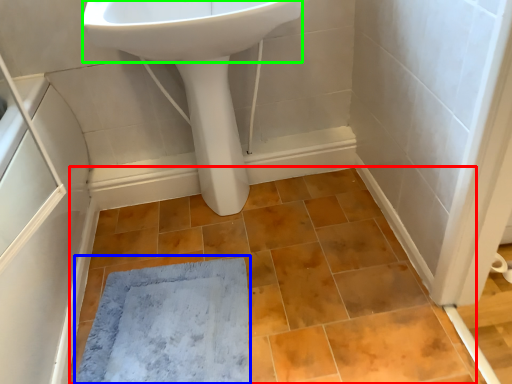
Question: Estimate the real-world distances between objects in this image. Which object is closer to ceramic tile (highlighted by a red box), bath mat (highlighted by a blue box) or sink (highlighted by a green box)?

Choices:
 (A) bath mat
 (B) sink

Answer: (A)